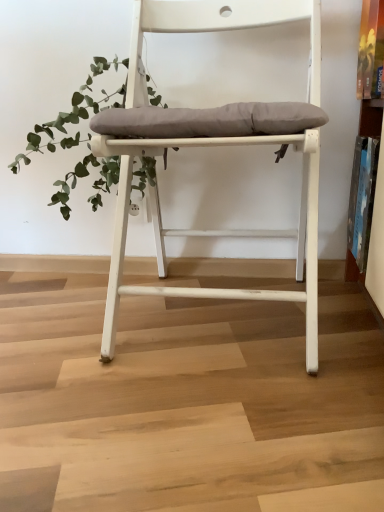
Describe the element at coordinates (215, 145) in the screenshot. The image size is (384, 512). I see `white matte chair at center` at that location.

This screenshot has height=512, width=384. I want to click on white matte chair at center, so pyautogui.click(x=215, y=145).

This screenshot has width=384, height=512. What do you see at coordinates (73, 115) in the screenshot?
I see `green leafy plant at upper left` at bounding box center [73, 115].

Locate an element on the screen. This screenshot has width=384, height=512. green leafy plant at upper left is located at coordinates (73, 115).

Measure the distance between green leafy plant at upper left and camera.

green leafy plant at upper left is 37.36 inches away from camera.

This screenshot has width=384, height=512. Find the location of `white matte chair at center`. white matte chair at center is located at coordinates (215, 145).

Does white matte chair at center appear on the left side of green leafy plant at upper left?

No.

Is the position of white matte chair at center more distant than that of green leafy plant at upper left?

No, white matte chair at center is closer to the viewer.

Does point (227, 12) appear closer or farther from the camera than point (84, 106)?

Point (227, 12) is closer to the camera than point (84, 106).

From the image's perspective, is white matte chair at center located beneath green leafy plant at upper left?

Indeed, from the image's perspective, white matte chair at center is shown beneath green leafy plant at upper left.

From a real-world perspective, which is physically below, white matte chair at center or green leafy plant at upper left?

white matte chair at center.

Which object is thinner, white matte chair at center or green leafy plant at upper left?

With smaller width is green leafy plant at upper left.

From the picture: Between white matte chair at center and green leafy plant at upper left, which one has less height?

green leafy plant at upper left is shorter.

Considering the sizes of objects white matte chair at center and green leafy plant at upper left in the image provided, who is bigger, white matte chair at center or green leafy plant at upper left?

white matte chair at center.

Would you say white matte chair at center is inside or outside green leafy plant at upper left?

white matte chair at center cannot be found inside green leafy plant at upper left.

Are white matte chair at center and green leafy plant at upper left located far from each other?

They are positioned close to each other.

Does white matte chair at center turn towards green leafy plant at upper left?

No, white matte chair at center is not oriented towards green leafy plant at upper left.

I want to click on chair that is under the green leafy plant at upper left (from a real-world perspective), so click(215, 145).

Is green leafy plant at upper left to the left or to the right of white matte chair at center in the image?

From the image, it's evident that green leafy plant at upper left is to the left of white matte chair at center.

Is green leafy plant at upper left positioned in front of white matte chair at center?

No.

Which is less distant, (88, 84) or (154, 148)?

Point (88, 84).

From the image's perspective, between green leafy plant at upper left and white matte chair at center, who is located below?

white matte chair at center.

Looking at this image, from a real-world perspective, relative to white matte chair at center, is green leafy plant at upper left vertically above or below?

From a real-world perspective, green leafy plant at upper left is physically above white matte chair at center.

Can you confirm if green leafy plant at upper left is thinner than white matte chair at center?

Yes, green leafy plant at upper left is thinner than white matte chair at center.

Based on the photo, does green leafy plant at upper left have a lesser height compared to white matte chair at center?

Yes.

Who is bigger, green leafy plant at upper left or white matte chair at center?

Bigger between the two is white matte chair at center.

Is green leafy plant at upper left surrounding white matte chair at center?

Definitely not — white matte chair at center is not inside green leafy plant at upper left.

Would you say green leafy plant at upper left is a long distance from white matte chair at center?

No, there isn't a large distance between green leafy plant at upper left and white matte chair at center.

Consider the image. Does green leafy plant at upper left turn towards white matte chair at center?

No, green leafy plant at upper left is not oriented towards white matte chair at center.

How different are the orientations of green leafy plant at upper left and white matte chair at center in degrees?

They differ by 1.17 degrees in their facing directions.

The image size is (384, 512). Find the location of `chair beneath the green leafy plant at upper left (from a real-world perspective)`. chair beneath the green leafy plant at upper left (from a real-world perspective) is located at coordinates (215, 145).

Where is `chair on the right of green leafy plant at upper left`? chair on the right of green leafy plant at upper left is located at coordinates click(215, 145).

What are the coordinates of `vegetation to the left of white matte chair at center` in the screenshot? It's located at coord(73,115).